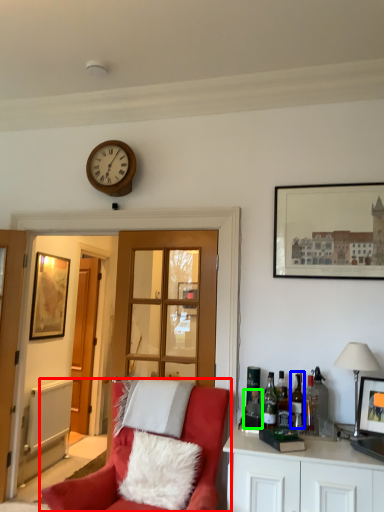
Question: Based on their relative distances, which object is farther from chair (highlighted by a red box)? Choose from wine bottle (highlighted by a blue box) and bottle (highlighted by a green box).

Choices:
 (A) wine bottle
 (B) bottle

Answer: (A)